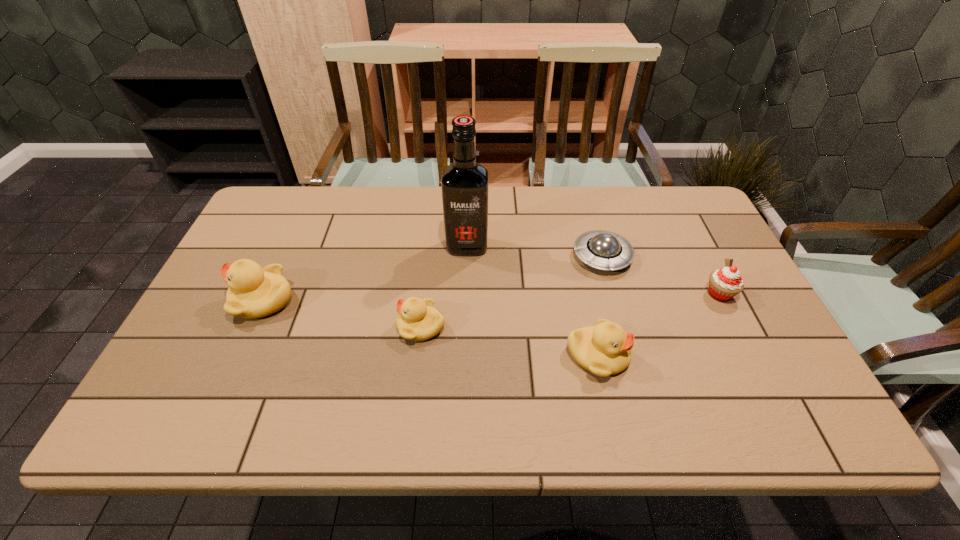
Identify the location of free point between the liquor and the rightmost object. (593, 270).

The width and height of the screenshot is (960, 540). I want to click on vacant space that is in between the second duckling from left to right and the leftmost object, so click(x=343, y=313).

Select which object appears as the fifth closest to the cupcake. Please provide its 2D coordinates. Your answer should be formatted as a tuple, i.e. [(x, y)], where the tuple contains the x and y coordinates of a point satisfying the conditions above.

[(253, 292)]

Identify which object is the third nearest to the shortest object. Please provide its 2D coordinates. Your answer should be formatted as a tuple, i.e. [(x, y)], where the tuple contains the x and y coordinates of a point satisfying the conditions above.

[(465, 184)]

Locate which duckling is the second closest to the cupcake. Please provide its 2D coordinates. Your answer should be formatted as a tuple, i.e. [(x, y)], where the tuple contains the x and y coordinates of a point satisfying the conditions above.

[(418, 320)]

At what (x,y) coordinates should I click in order to perform the action: click on duckling object that ranks as the closest to the tallest object. Please return your answer as a coordinate pair (x, y). Image resolution: width=960 pixels, height=540 pixels. Looking at the image, I should click on (418, 320).

You are a GUI agent. You are given a task and a screenshot of the screen. Output one action in this format:
    pyautogui.click(x=<x>, y=<y>)
    Task: Click on the vacant space that satisfies the following two spatial constraints: 1. on the front-facing side of the tallest object; 2. at the face of the second shortest object
    The image size is (960, 540).
    Given the screenshot: What is the action you would take?
    pyautogui.click(x=465, y=326)

This screenshot has width=960, height=540. What are the coordinates of `vacant space that satisfies the following two spatial constraints: 1. on the front-facing side of the tallest object; 2. at the face of the leftmost duckling` in the screenshot? It's located at (466, 300).

Image resolution: width=960 pixels, height=540 pixels. I want to click on vacant space that satisfies the following two spatial constraints: 1. on the front-facing side of the cupcake; 2. on the left side of the tallest object, so click(466, 294).

The image size is (960, 540). Identify the location of blank area in the image that satisfies the following two spatial constraints: 1. on the front-facing side of the saucer; 2. on the right side of the liquor. (467, 256).